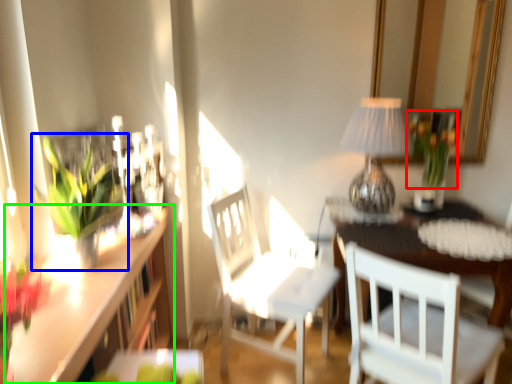
Question: Estimate the real-world distances between objects in this image. Which object is farther from floral arrangement (highlighted by a red box), houseplant (highlighted by a blue box) or counter (highlighted by a green box)?

Choices:
 (A) houseplant
 (B) counter

Answer: (A)